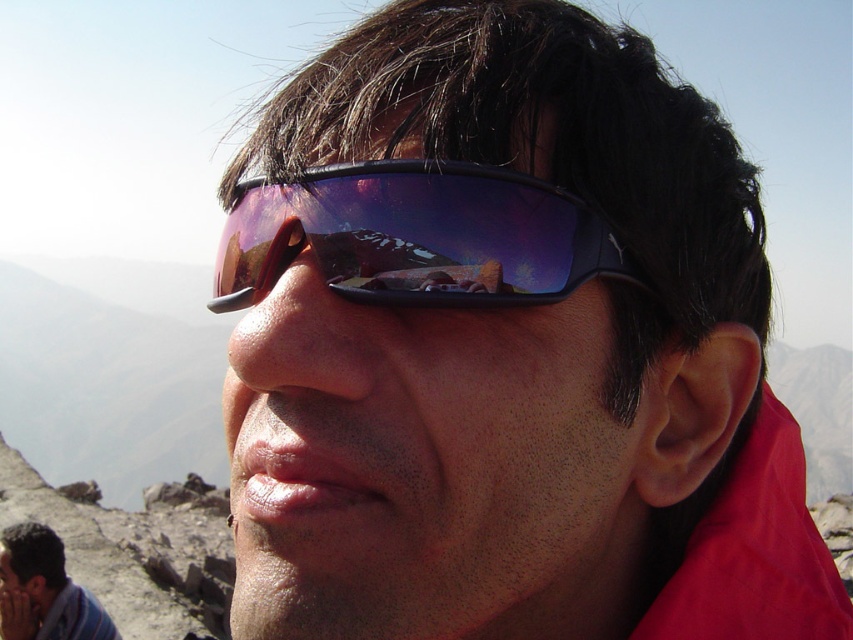
You are a photographer trying to capture the mountain view. You have two sunglasses options in your bag. The purple reflective lens at center and the matte blue sunglasses at lower left. Which one has a wider frame to block more sunlight?

The matte blue sunglasses at lower left has a wider frame than the purple reflective lens at center, so it can block more sunlight.

You are a photographer trying to capture the reflection details of both the purple reflective lens at center and the matte blue sunglasses at lower left. Which object should you focus on first to ensure the reflection is clear in your photo?

The purple reflective lens at center should be focused on first because it is closer to the viewer than the matte blue sunglasses at lower left, making its reflection more prominent and easier to capture clearly.